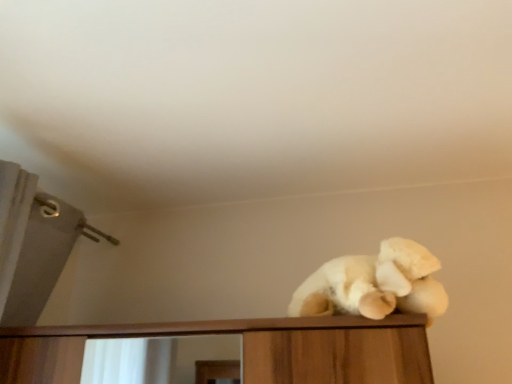
In order to face soft plush bear at center, should I rotate leftwards or rightwards?

You should rotate right by 14.729 degrees.

Describe the element at coordinates (374, 284) in the screenshot. I see `soft plush bear at center` at that location.

You are a GUI agent. You are given a task and a screenshot of the screen. Output one action in this format:
    pyautogui.click(x=<x>, y=<y>)
    Task: Click on the soft plush bear at center
    
    Given the screenshot: What is the action you would take?
    tap(374, 284)

This screenshot has width=512, height=384. In order to click on soft plush bear at center in this screenshot , I will do `click(374, 284)`.